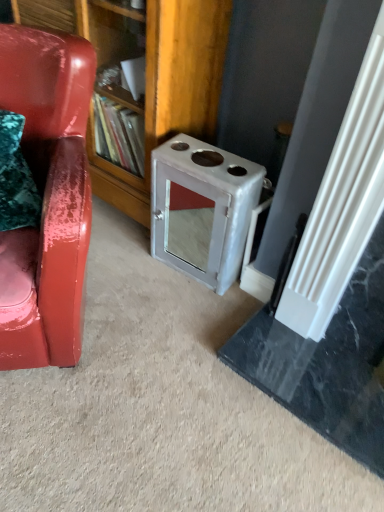
Question: Is wooden bookshelf at center bigger or smaller than metallic gray stove at center-right?

Choices:
 (A) big
 (B) small

Answer: (A)

Question: From the image's perspective, is wooden bookshelf at center located above or below metallic gray stove at center-right?

Choices:
 (A) above
 (B) below

Answer: (A)

Question: Which object is positioned closest to the glossy leather chair at left?

Choices:
 (A) metallic gray stove at center-right
 (B) wooden bookshelf at center

Answer: (B)

Question: Which object is the closest to the metallic gray stove at center-right?

Choices:
 (A) wooden bookshelf at center
 (B) glossy leather chair at left

Answer: (A)